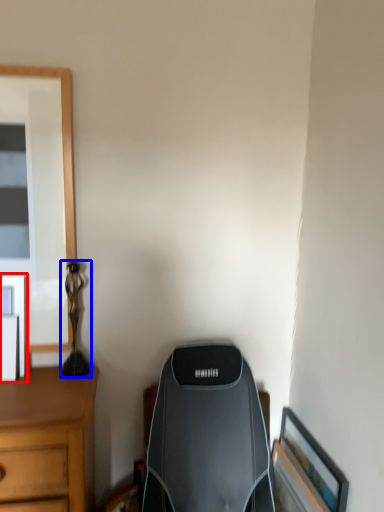
Question: Among these objects, which one is farthest to the camera, picture frame (highlighted by a red box) or table lamp (highlighted by a blue box)?

Choices:
 (A) picture frame
 (B) table lamp

Answer: (B)